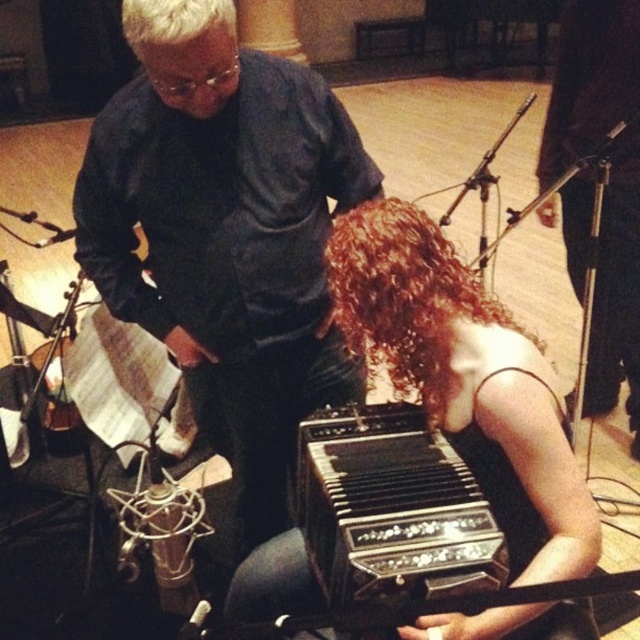
Question: Can you confirm if dark blue shirt at upper center is positioned to the left of curly brown hair at lower center?

Choices:
 (A) no
 (B) yes

Answer: (B)

Question: In this image, where is shiny black accordion at center located relative to curly brown hair at lower center?

Choices:
 (A) right
 (B) left

Answer: (A)

Question: Can you confirm if dark blue shirt at upper center is thinner than shiny black accordion at center?

Choices:
 (A) yes
 (B) no

Answer: (B)

Question: Which is farther from the black polished wood accordion at lower center?

Choices:
 (A) shiny black accordion at center
 (B) dark blue shirt at upper center
 (C) curly brown hair at lower center

Answer: (B)

Question: Which of the following is the closest to the observer?

Choices:
 (A) (316, 502)
 (B) (339, 230)
 (C) (328, 312)

Answer: (B)

Question: Which of the following is the closest to the observer?

Choices:
 (A) (404, 387)
 (B) (333, 241)
 (C) (464, 520)
 (D) (172, 145)

Answer: (C)